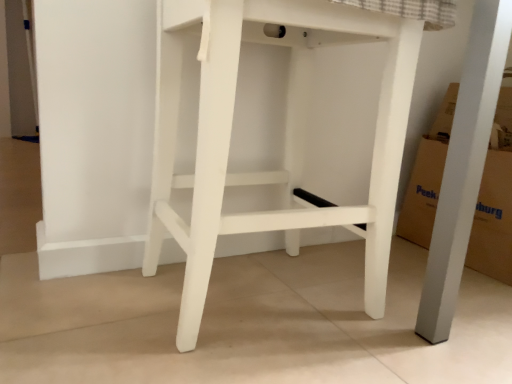
Question: Is white matte stool at center far away from cardboard at right?

Choices:
 (A) yes
 (B) no

Answer: (B)

Question: Does white matte stool at center lie behind cardboard at right?

Choices:
 (A) no
 (B) yes

Answer: (A)

Question: From a real-world perspective, is white matte stool at center beneath cardboard at right?

Choices:
 (A) no
 (B) yes

Answer: (A)

Question: Considering the relative sizes of white matte stool at center and cardboard at right in the image provided, is white matte stool at center shorter than cardboard at right?

Choices:
 (A) no
 (B) yes

Answer: (A)

Question: Does white matte stool at center have a greater width compared to cardboard at right?

Choices:
 (A) no
 (B) yes

Answer: (B)

Question: Is white matte stool at center bigger than cardboard at right?

Choices:
 (A) yes
 (B) no

Answer: (A)

Question: From a real-world perspective, is cardboard at right under white matte stool at center?

Choices:
 (A) no
 (B) yes

Answer: (B)

Question: Does cardboard at right come in front of white matte stool at center?

Choices:
 (A) yes
 (B) no

Answer: (B)

Question: Does cardboard at right have a greater width compared to white matte stool at center?

Choices:
 (A) yes
 (B) no

Answer: (B)

Question: Is cardboard at right turned away from white matte stool at center?

Choices:
 (A) no
 (B) yes

Answer: (A)

Question: Can you confirm if cardboard at right is positioned to the left of white matte stool at center?

Choices:
 (A) no
 (B) yes

Answer: (A)

Question: From the image's perspective, is cardboard at right above white matte stool at center?

Choices:
 (A) yes
 (B) no

Answer: (B)

Question: From their relative heights in the image, would you say cardboard at right is taller or shorter than white matte stool at center?

Choices:
 (A) tall
 (B) short

Answer: (B)